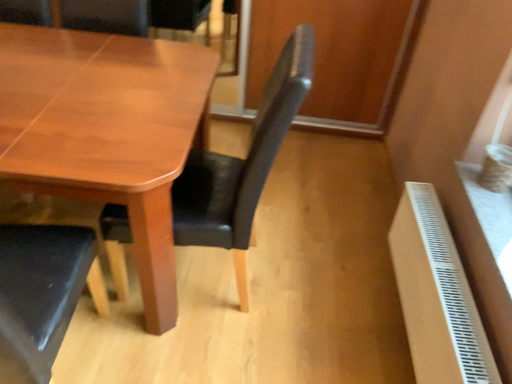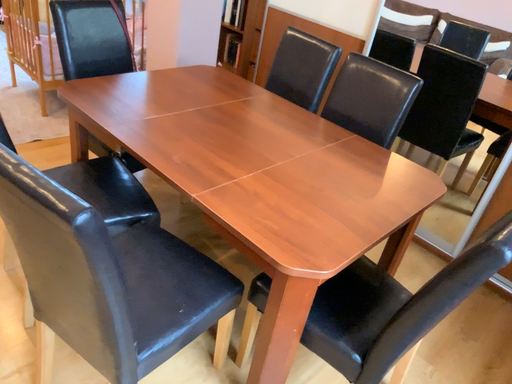
Question: Which way did the camera rotate in the video?

Choices:
 (A) rotated downward
 (B) rotated upward

Answer: (B)